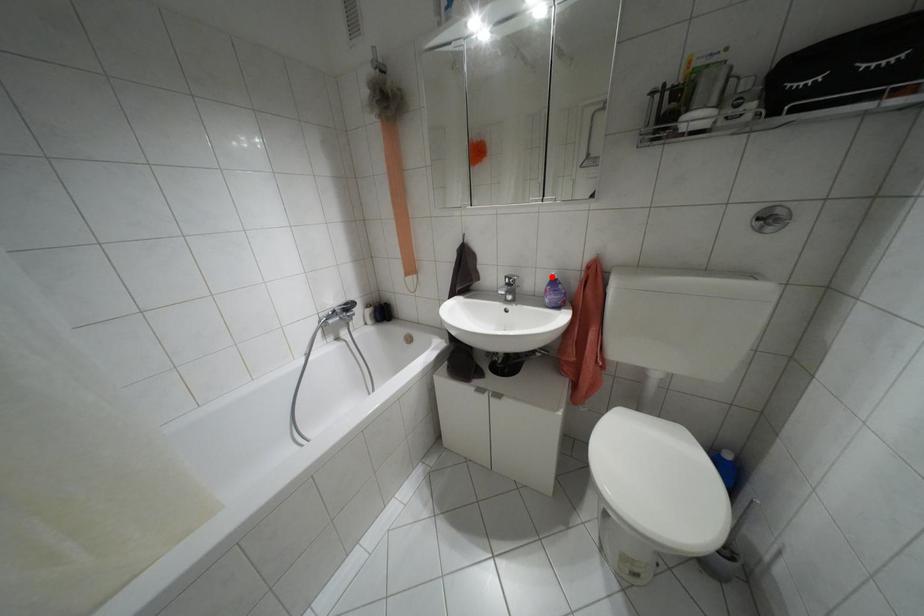
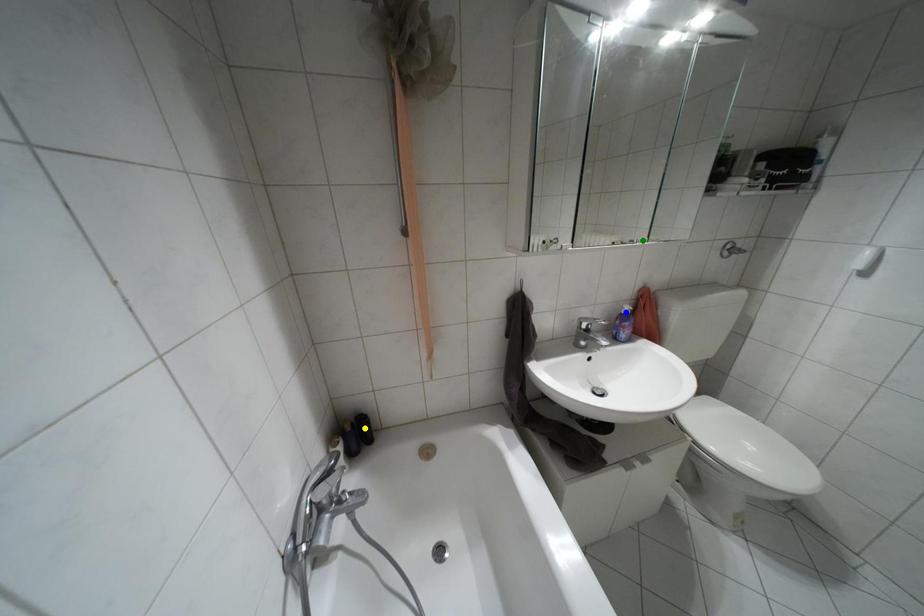
Question: I am providing you with two images of the same scene from different viewpoints. A red point is marked on the first image. You are given multiple points on the second image. In image 2, which mark is for the same physical point as the one in image 1?

Choices:
 (A) yellow point
 (B) blue point
 (C) green point

Answer: (B)